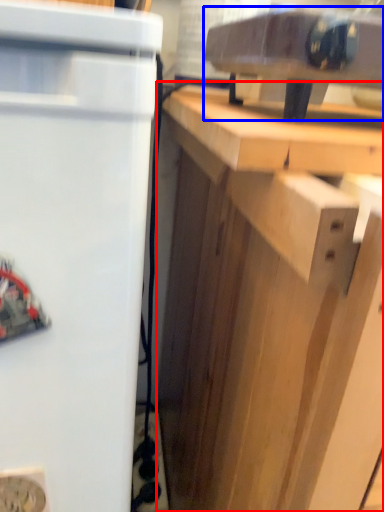
Question: Which point is further to the camera, cabinetry (highlighted by a red box) or appliance (highlighted by a blue box)?

Choices:
 (A) cabinetry
 (B) appliance

Answer: (B)